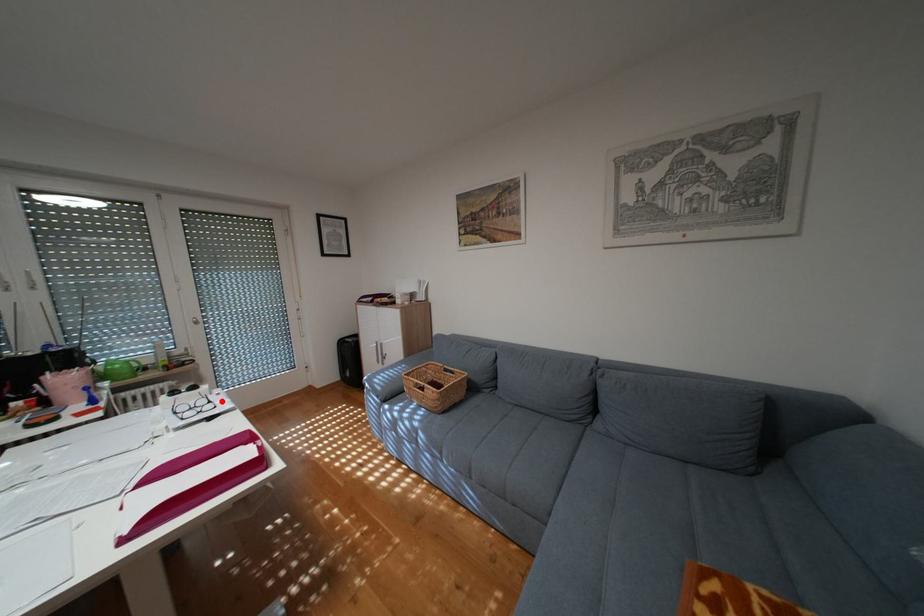
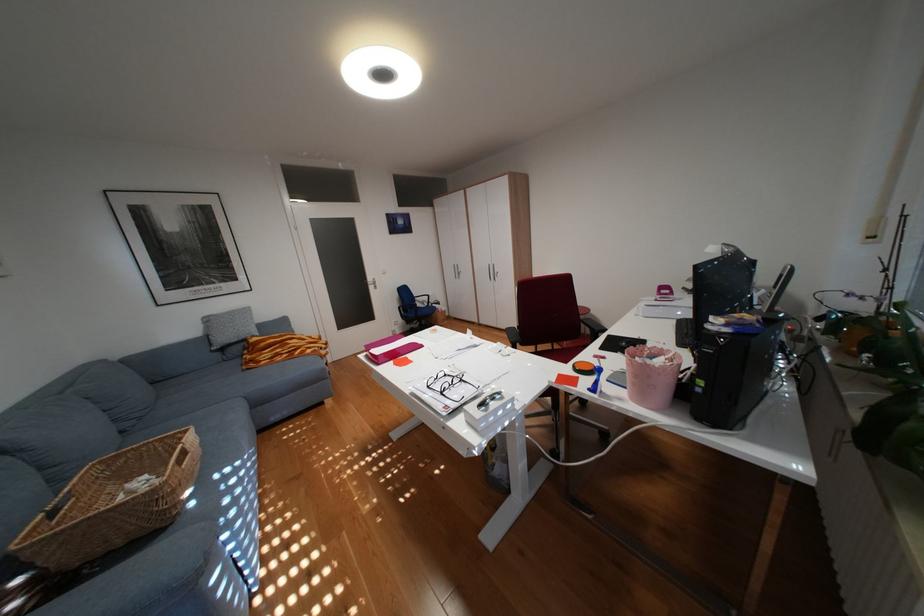
Locate, in the second image, the point that corresponds to the highlighted location in the first image.

(454, 392)